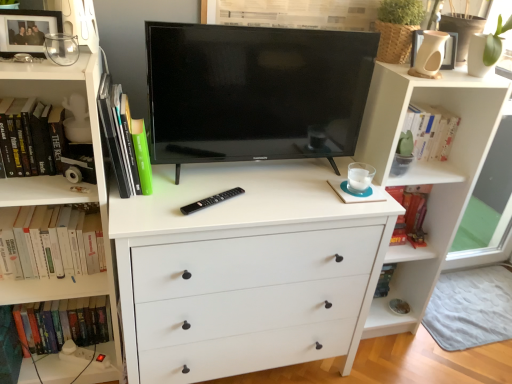
Question: Are matte black picture frame at upper left, which ranks as the 2th picture frame in back-to-front order, and hardcover book at left, the 1th book in the top-to-bottom sequence, making contact?

Choices:
 (A) no
 (B) yes

Answer: (A)

Question: Can you confirm if matte black picture frame at upper left, which is the first picture frame in front-to-back order, is wider than hardcover book at left, positioned as the 4th book in bottom-to-top order?

Choices:
 (A) no
 (B) yes

Answer: (A)

Question: Is matte black picture frame at upper left, which is the first picture frame in front-to-back order, outside hardcover book at left, positioned as the 4th book in bottom-to-top order?

Choices:
 (A) no
 (B) yes

Answer: (B)

Question: From the image's perspective, is matte black picture frame at upper left, positioned as the 2th picture frame in right-to-left order, on hardcover book at left, positioned as the 4th book in bottom-to-top order?

Choices:
 (A) no
 (B) yes

Answer: (B)

Question: From the image's perspective, is matte black picture frame at upper left, which is the first picture frame in front-to-back order, below hardcover book at left, positioned as the 4th book in bottom-to-top order?

Choices:
 (A) yes
 (B) no

Answer: (B)

Question: Looking at the image, does white matte chest of drawers at center seem bigger or smaller compared to black glossy tv at center?

Choices:
 (A) small
 (B) big

Answer: (B)

Question: Is white matte chest of drawers at center wider or thinner than black glossy tv at center?

Choices:
 (A) thin
 (B) wide

Answer: (B)

Question: Considering the positions of point (215, 324) and point (148, 23), is point (215, 324) closer or farther from the camera than point (148, 23)?

Choices:
 (A) closer
 (B) farther

Answer: (B)

Question: From a real-world perspective, relative to black glossy tv at center, is white matte chest of drawers at center vertically above or below?

Choices:
 (A) above
 (B) below

Answer: (B)

Question: From a real-world perspective, is black glossy tv at center above or below hardcover book at left, positioned as the 4th book in bottom-to-top order?

Choices:
 (A) below
 (B) above

Answer: (B)

Question: Considering the positions of black glossy tv at center and hardcover book at left, positioned as the 4th book in bottom-to-top order, in the image, is black glossy tv at center wider or thinner than hardcover book at left, positioned as the 4th book in bottom-to-top order,?

Choices:
 (A) wide
 (B) thin

Answer: (B)

Question: Based on their sizes in the image, would you say black glossy tv at center is bigger or smaller than hardcover book at left, the 1th book in the top-to-bottom sequence?

Choices:
 (A) big
 (B) small

Answer: (A)

Question: From their relative heights in the image, would you say black glossy tv at center is taller or shorter than hardcover book at left, the 1th book in the top-to-bottom sequence?

Choices:
 (A) short
 (B) tall

Answer: (B)

Question: Based on their positions, is hardcover book at left, marked as the first book in a bottom-to-top arrangement, located to the left or right of matte white picture frame at upper right, which is counted as the first picture frame, starting from the right?

Choices:
 (A) right
 (B) left

Answer: (B)

Question: Considering the positions of hardcover book at left, acting as the fourth book starting from the top, and matte white picture frame at upper right, acting as the second picture frame starting from the front, in the image, is hardcover book at left, acting as the fourth book starting from the top, wider or thinner than matte white picture frame at upper right, acting as the second picture frame starting from the front,?

Choices:
 (A) wide
 (B) thin

Answer: (A)